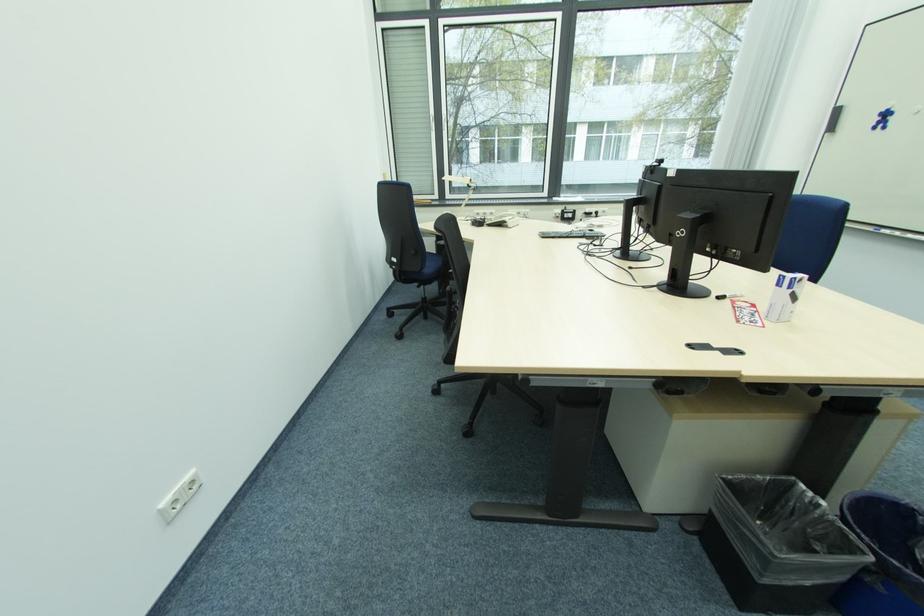
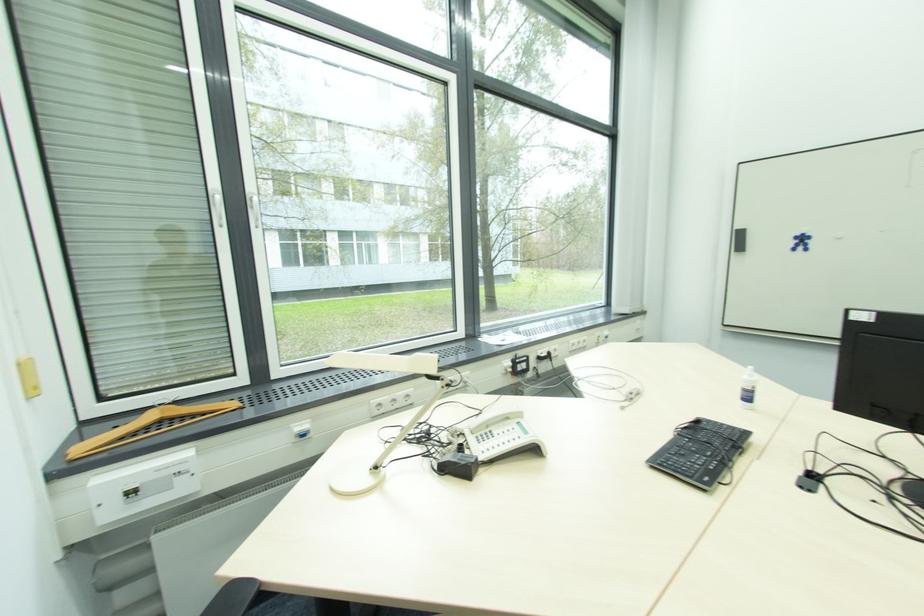
Locate, in the second image, the point that corresponds to point 594,233 in the first image.

(700, 424)